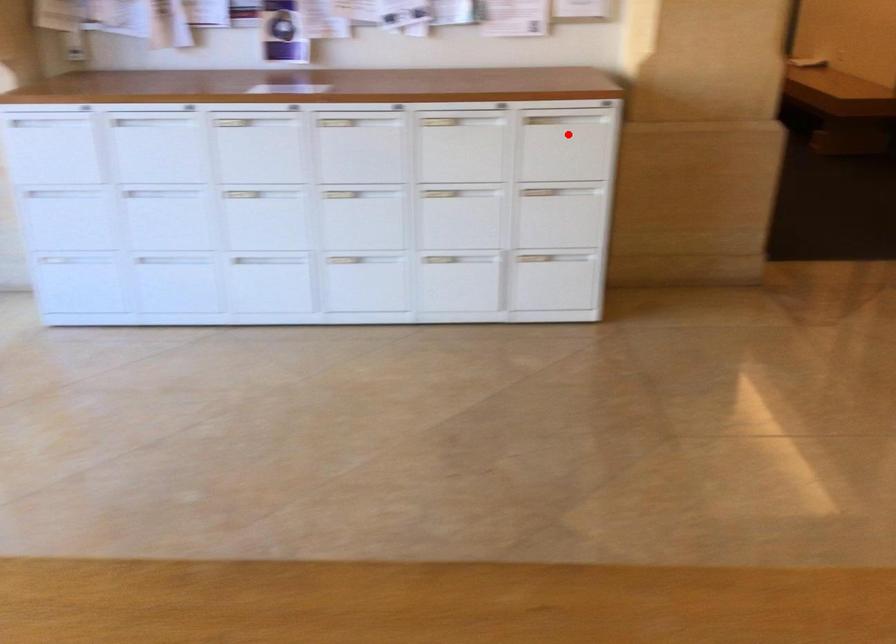
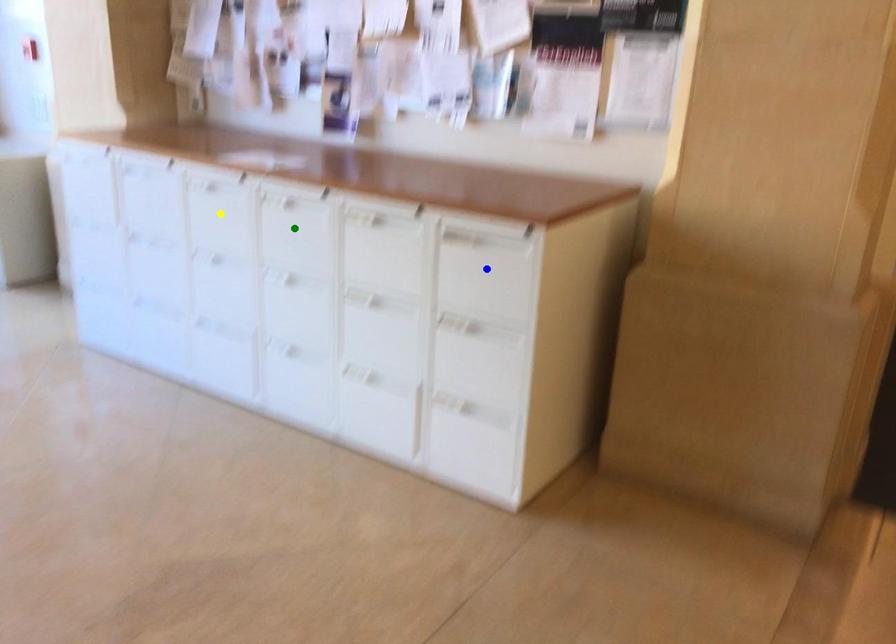
Question: I am providing you with two images of the same scene from different viewpoints. A red point is marked on the first image. You are given multiple points on the second image. Which point in image 2 represents the same 3d spot as the red point in image 1?

Choices:
 (A) green point
 (B) blue point
 (C) yellow point

Answer: (B)